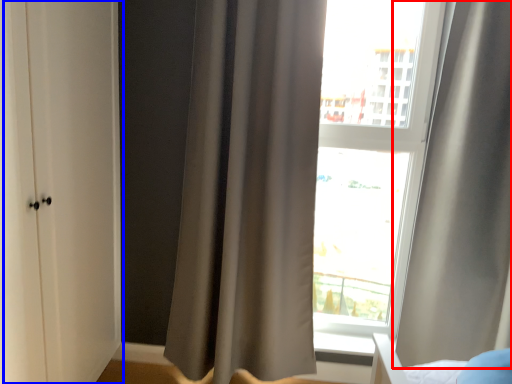
Question: Which object appears farthest to the camera in this image, curtain (highlighted by a red box) or screen door (highlighted by a blue box)?

Choices:
 (A) curtain
 (B) screen door

Answer: (A)